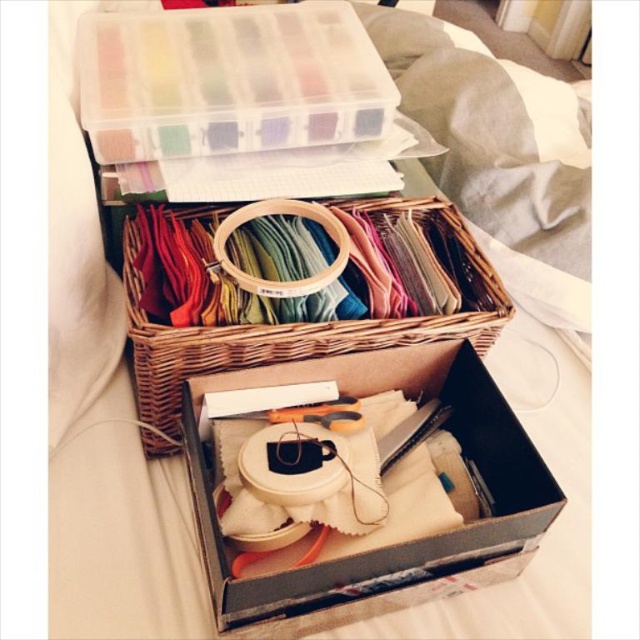
Question: Which of these objects is positioned closest to the woven wood basket at center?

Choices:
 (A) clear plastic container at upper center
 (B) white cardboard box at center

Answer: (B)

Question: Can you confirm if clear plastic container at upper center is thinner than woven wood basket at center?

Choices:
 (A) yes
 (B) no

Answer: (A)

Question: Which object is the farthest from the woven wood basket at center?

Choices:
 (A) clear plastic container at upper center
 (B) white cardboard box at center

Answer: (A)

Question: Can you confirm if clear plastic container at upper center is positioned above white cardboard box at center?

Choices:
 (A) no
 (B) yes

Answer: (B)

Question: Estimate the real-world distances between objects in this image. Which object is farther from the clear plastic container at upper center?

Choices:
 (A) woven wood basket at center
 (B) white cardboard box at center

Answer: (B)

Question: In this image, where is white cardboard box at center located relative to woven wood basket at center?

Choices:
 (A) left
 (B) right

Answer: (B)